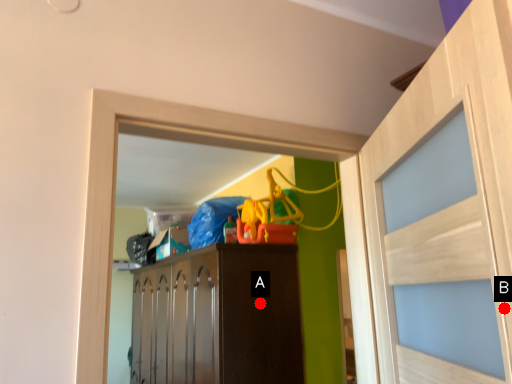
Question: Two points are circled on the image, labeled by A and B beside each circle. Which point is closer to the camera taking this photo?

Choices:
 (A) A is closer
 (B) B is closer

Answer: (B)